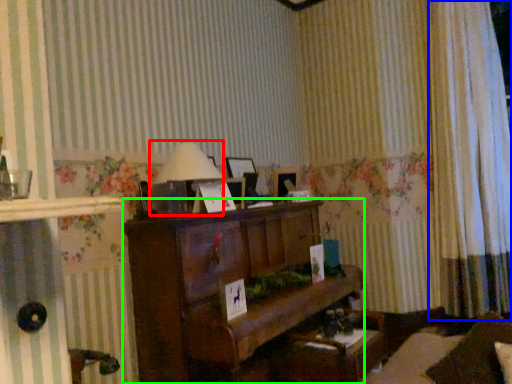
Question: Which is nearer to the table lamp (highlighted by a red box)? curtain (highlighted by a blue box) or furniture (highlighted by a green box).

Choices:
 (A) curtain
 (B) furniture

Answer: (B)